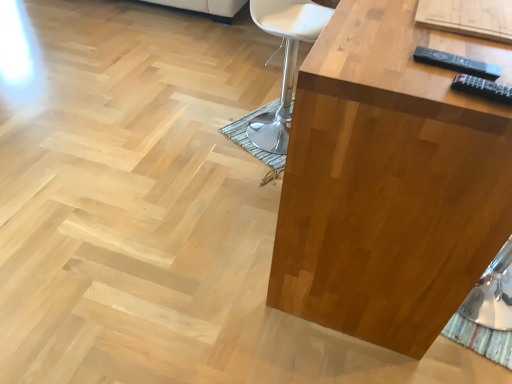
The image size is (512, 384). What are the coordinates of `vacant area on the back side of black plastic remote at upper right, the second remote from the top` in the screenshot? It's located at (462, 58).